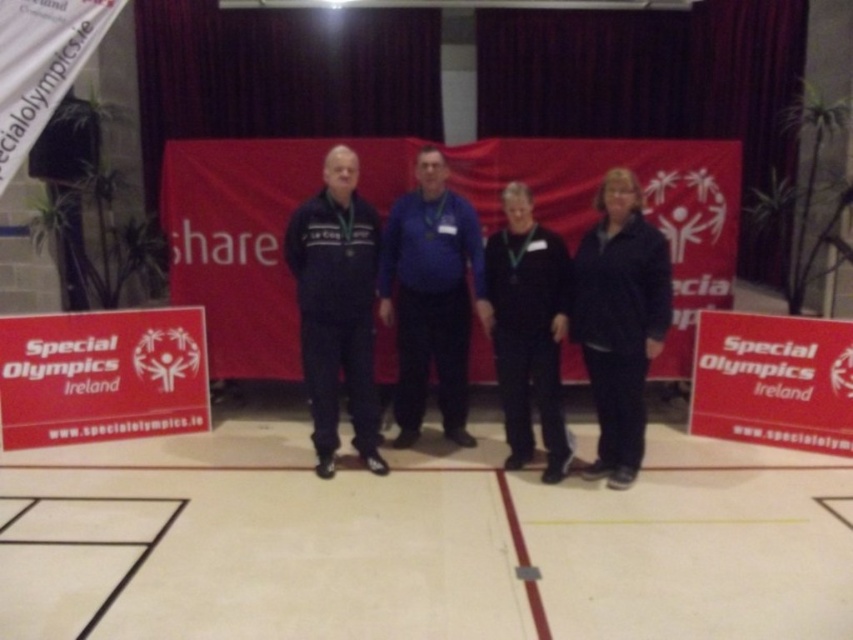
Question: Which point is farther from the camera taking this photo?

Choices:
 (A) (627, 305)
 (B) (300, 339)

Answer: (B)

Question: Does matte blue tracksuit at center appear over black matte jacket at center?

Choices:
 (A) no
 (B) yes

Answer: (B)

Question: Can you confirm if matte blue tracksuit at center is thinner than black matte jacket at center?

Choices:
 (A) yes
 (B) no

Answer: (B)

Question: Which of the following is the farthest from the observer?

Choices:
 (A) (454, 330)
 (B) (326, 365)
 (C) (628, 227)

Answer: (A)

Question: Considering the real-world distances, which object is closest to the matte blue tracksuit at center?

Choices:
 (A) blue fabric shirt at center
 (B) black matte jacket at center
 (C) dark blue jacket at center

Answer: (A)

Question: Can you confirm if blue fabric shirt at center is positioned to the left of dark blue jacket at center?

Choices:
 (A) yes
 (B) no

Answer: (A)